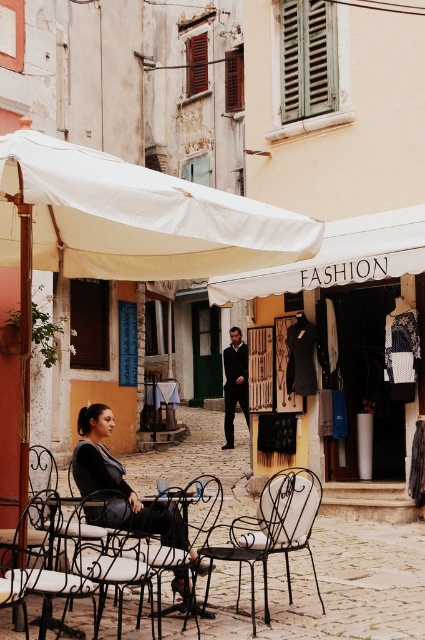
Looking at this image, which is below, white fabric canopy at upper center or textured fabric clothing at center?

textured fabric clothing at center is lower down.

Does white fabric canopy at upper center appear on the right side of textured fabric clothing at center?

No, white fabric canopy at upper center is not to the right of textured fabric clothing at center.

Is point (235, 224) positioned before point (317, 253)?

Yes, it is in front of point (317, 253).

Identify the location of white fabric canopy at upper center. (133, 218).

Is white wrought iron chair at center above metallic silver chair at lower left?

Yes, white wrought iron chair at center is above metallic silver chair at lower left.

In order to click on white wrought iron chair at center in this screenshot , I will do `click(277, 529)`.

Can you confirm if dark blue suit at center is taller than wooden table at center?

Indeed, dark blue suit at center has a greater height compared to wooden table at center.

The width and height of the screenshot is (425, 640). What do you see at coordinates (235, 384) in the screenshot? I see `dark blue suit at center` at bounding box center [235, 384].

Between point (237, 394) and point (172, 413), which one is positioned in front?

Point (237, 394) is in front.

Where is `dark blue suit at center`? The image size is (425, 640). dark blue suit at center is located at coordinates [x=235, y=384].